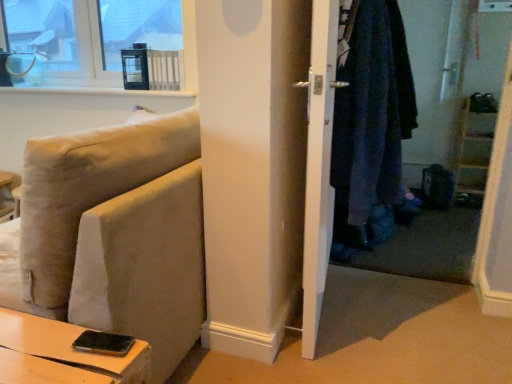
The width and height of the screenshot is (512, 384). Find the location of `denim jacket at right`. denim jacket at right is located at coordinates (415, 136).

What do you see at coordinates (415, 136) in the screenshot? I see `denim jacket at right` at bounding box center [415, 136].

The image size is (512, 384). What are the coordinates of `beige fabric couch at lower left` in the screenshot? It's located at (116, 234).

The width and height of the screenshot is (512, 384). Find the location of `denim jacket at right`. denim jacket at right is located at coordinates (415, 136).

Can you tell me how much clear glass window at upper left and denim jacket at right differ in facing direction?

There is a 1.5-degree angle between the facing directions of clear glass window at upper left and denim jacket at right.

From the image's perspective, is clear glass window at upper left above denim jacket at right?

Yes.

Can you confirm if clear glass window at upper left is wider than denim jacket at right?

Incorrect, the width of clear glass window at upper left does not surpass that of denim jacket at right.

Could you tell me if clear glass window at upper left is facing denim jacket at right?

No, clear glass window at upper left is not oriented towards denim jacket at right.

Is beige fabric couch at lower left completely or partially outside of clear glass window at upper left?

Absolutely, beige fabric couch at lower left is external to clear glass window at upper left.

From the picture: How far apart are beige fabric couch at lower left and clear glass window at upper left?

beige fabric couch at lower left is 1.47 meters away from clear glass window at upper left.

From the picture: Which of these two, beige fabric couch at lower left or clear glass window at upper left, stands shorter?

clear glass window at upper left is shorter.

Between point (150, 268) and point (308, 81), which one is positioned in front?

The point (150, 268) is closer.

Considering the relative positions of beige fabric couch at lower left and white glossy door at center in the image provided, is beige fabric couch at lower left in front of white glossy door at center?

Yes, beige fabric couch at lower left is in front of white glossy door at center.

Which object is thinner, beige fabric couch at lower left or white glossy door at center?

With smaller width is white glossy door at center.

From a real-world perspective, is beige fabric couch at lower left beneath white glossy door at center?

Yes, from a real-world perspective, beige fabric couch at lower left is under white glossy door at center.

Which point is more distant from viewer, [453,107] or [317,272]?

Point [453,107]

Considering the positions of objects denim jacket at right and white glossy door at center in the image provided, who is more to the left, denim jacket at right or white glossy door at center?

white glossy door at center is more to the left.

Does denim jacket at right have a greater width compared to white glossy door at center?

Correct, the width of denim jacket at right exceeds that of white glossy door at center.

Consider the image. Is beige fabric couch at lower left to the right of denim jacket at right from the viewer's perspective?

No, beige fabric couch at lower left is not to the right of denim jacket at right.

Does point (181, 121) come behind point (425, 103)?

No, it is not.

Is beige fabric couch at lower left bigger or smaller than denim jacket at right?

beige fabric couch at lower left is bigger than denim jacket at right.

Can denim jacket at right be found inside white glossy door at center?

Actually, denim jacket at right is outside white glossy door at center.

From the image's perspective, who appears lower, white glossy door at center or denim jacket at right?

white glossy door at center appears lower in the image.

From their relative heights in the image, would you say white glossy door at center is taller or shorter than denim jacket at right?

Considering their sizes, white glossy door at center has more height than denim jacket at right.

Is white glossy door at center oriented away from denim jacket at right?

No, white glossy door at center is not facing away from denim jacket at right.

Which object is wider, denim jacket at right or beige fabric couch at lower left?

beige fabric couch at lower left is wider.

Can you confirm if denim jacket at right is positioned to the right of beige fabric couch at lower left?

Indeed, denim jacket at right is positioned on the right side of beige fabric couch at lower left.

From the image's perspective, is denim jacket at right under beige fabric couch at lower left?

No.

Is denim jacket at right positioned in front of beige fabric couch at lower left?

No, it is behind beige fabric couch at lower left.

In the image, there is a clear glass window at upper left. Where is `closet below it (from the image's perspective)`? The image size is (512, 384). closet below it (from the image's perspective) is located at coordinates (415, 136).

Find the location of a particular element. This screenshot has height=384, width=512. studio couch in front of the clear glass window at upper left is located at coordinates (116, 234).

Looking at the image, which one is located closer to beige fabric couch at lower left, clear glass window at upper left or denim jacket at right?

Among the two, denim jacket at right is located nearer to beige fabric couch at lower left.

From the image, which object appears to be nearer to white glossy door at center, denim jacket at right or beige fabric couch at lower left?

beige fabric couch at lower left is positioned closer to the anchor white glossy door at center.

Based on their spatial positions, is white glossy door at center or clear glass window at upper left closer to beige fabric couch at lower left?

white glossy door at center.

Considering their positions, is denim jacket at right positioned closer to clear glass window at upper left than white glossy door at center?

Based on the image, white glossy door at center appears to be nearer to clear glass window at upper left.

Which object lies further to the anchor point clear glass window at upper left, white glossy door at center or denim jacket at right?

Based on the image, denim jacket at right appears to be further to clear glass window at upper left.

Estimate the real-world distances between objects in this image. Which object is further from white glossy door at center, clear glass window at upper left or denim jacket at right?

The object further to white glossy door at center is clear glass window at upper left.

Which object lies further to the anchor point clear glass window at upper left, beige fabric couch at lower left or white glossy door at center?

The object further to clear glass window at upper left is white glossy door at center.

Estimate the real-world distances between objects in this image. Which object is closer to beige fabric couch at lower left, white glossy door at center or denim jacket at right?

The object closer to beige fabric couch at lower left is white glossy door at center.

Identify the location of studio couch between clear glass window at upper left and denim jacket at right from left to right. This screenshot has width=512, height=384. (116, 234).

Find the location of a particular element. The width and height of the screenshot is (512, 384). studio couch located between clear glass window at upper left and white glossy door at center in the left-right direction is located at coordinates (116, 234).

The image size is (512, 384). In order to click on screen door between clear glass window at upper left and denim jacket at right in the horizontal direction in this screenshot , I will do `click(318, 167)`.

Locate an element on the screen. The width and height of the screenshot is (512, 384). screen door between beige fabric couch at lower left and denim jacket at right in the horizontal direction is located at coordinates (318, 167).